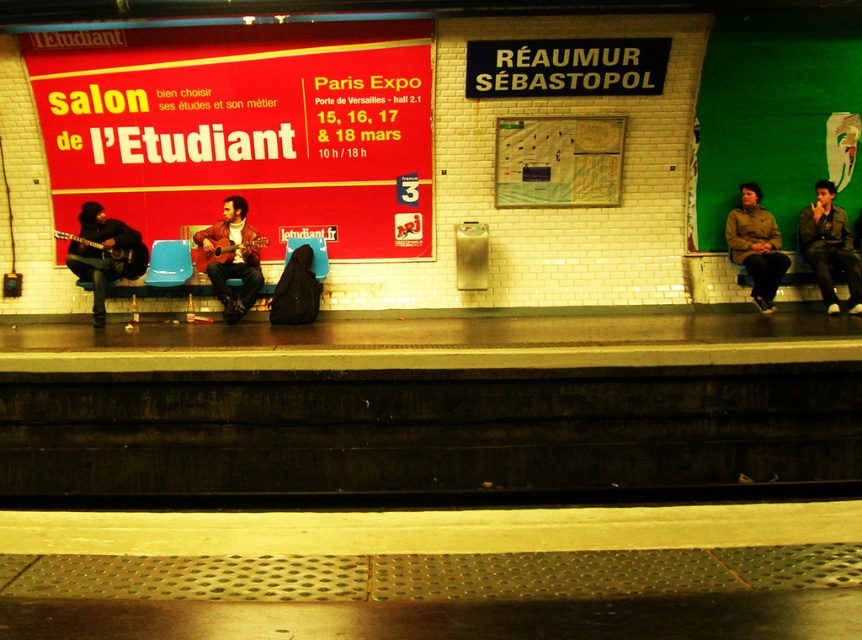
Question: Which point is closer to the camera?

Choices:
 (A) (320, 104)
 (B) (119, 220)
 (C) (205, 243)
 (D) (809, 209)

Answer: (C)

Question: Can you confirm if black leather jacket at left is positioned to the left of green matte jacket at right?

Choices:
 (A) no
 (B) yes

Answer: (B)

Question: Which of these objects is positioned farthest from the green matte jacket at right?

Choices:
 (A) red matte poster at center
 (B) black leather jacket at left
 (C) leather jacket at center

Answer: (B)

Question: Among these points, which one is farthest from the camera?

Choices:
 (A) (123, 116)
 (B) (823, 224)

Answer: (B)

Question: Considering the relative positions of black leather jacket at left and leather jacket at center in the image provided, where is black leather jacket at left located with respect to leather jacket at center?

Choices:
 (A) left
 (B) right

Answer: (A)

Question: Is the position of black leather jacket at left more distant than that of leather jacket at center?

Choices:
 (A) no
 (B) yes

Answer: (A)